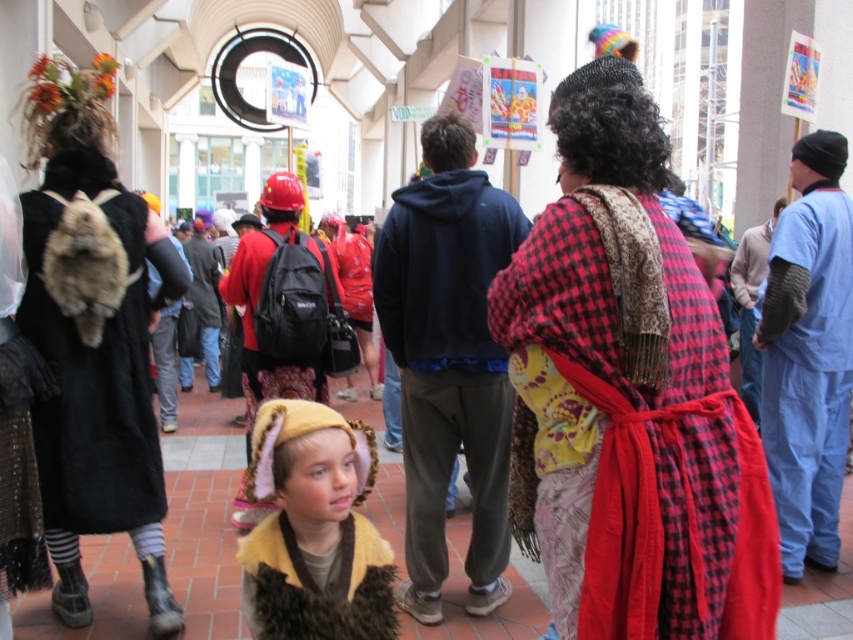
Question: From the image, what is the correct spatial relationship of red plaid dress at center in relation to fuzzy black coat at left?

Choices:
 (A) right
 (B) left

Answer: (A)

Question: Which point is closer to the camera?

Choices:
 (A) red plaid dress at center
 (B) fuzzy black coat at left
 (C) red plaid robe at right

Answer: (A)

Question: Estimate the real-world distances between objects in this image. Which object is closer to the red plaid dress at center?

Choices:
 (A) red plaid robe at center
 (B) fuzzy yellow hat at center
 (C) blue scrubs at right
 (D) fuzzy black coat at left

Answer: (B)

Question: Which point appears closest to the camera in this image?

Choices:
 (A) (282, 490)
 (B) (758, 349)

Answer: (A)

Question: Is red plaid dress at center further to the viewer compared to blue scrubs at right?

Choices:
 (A) no
 (B) yes

Answer: (A)

Question: Considering the relative positions of red plaid dress at center and fuzzy yellow hat at center in the image provided, where is red plaid dress at center located with respect to fuzzy yellow hat at center?

Choices:
 (A) left
 (B) right

Answer: (B)